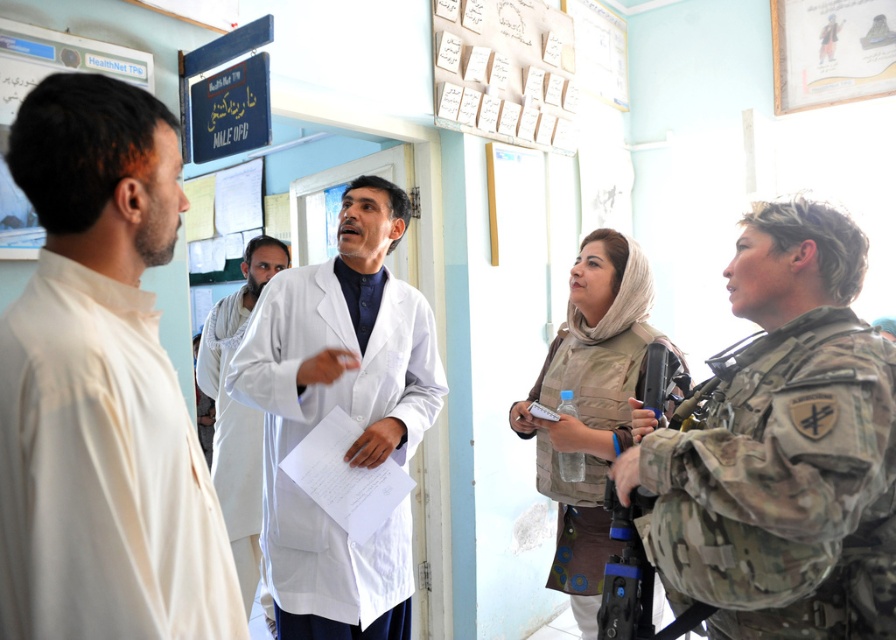
Can you confirm if white lab coat at left is positioned below camouflage fabric uniform at right?

No.

Who is shorter, white lab coat at left or camouflage fabric uniform at right?

camouflage fabric uniform at right

Is point (41, 500) positioned in front of point (640, 461)?

Yes, point (41, 500) is in front of point (640, 461).

You are a GUI agent. You are given a task and a screenshot of the screen. Output one action in this format:
    pyautogui.click(x=<x>, y=<y>)
    Task: Click on the white lab coat at left
    The height and width of the screenshot is (640, 896).
    Given the screenshot: What is the action you would take?
    pyautogui.click(x=101, y=388)

Does camouflage fabric uniform at right come behind camouflage vest at center?

That is False.

Based on the photo, is camouflage fabric uniform at right taller than camouflage vest at center?

No, camouflage fabric uniform at right is not taller than camouflage vest at center.

The width and height of the screenshot is (896, 640). I want to click on camouflage fabric uniform at right, so tap(784, 488).

The width and height of the screenshot is (896, 640). What do you see at coordinates (101, 388) in the screenshot?
I see `white lab coat at left` at bounding box center [101, 388].

Who is more distant from viewer, (52, 81) or (397, 620)?

The point (397, 620) is behind.

Which is behind, point (71, 237) or point (350, 321)?

The point (350, 321) is more distant.

Where is `white lab coat at left`? white lab coat at left is located at coordinates (101, 388).